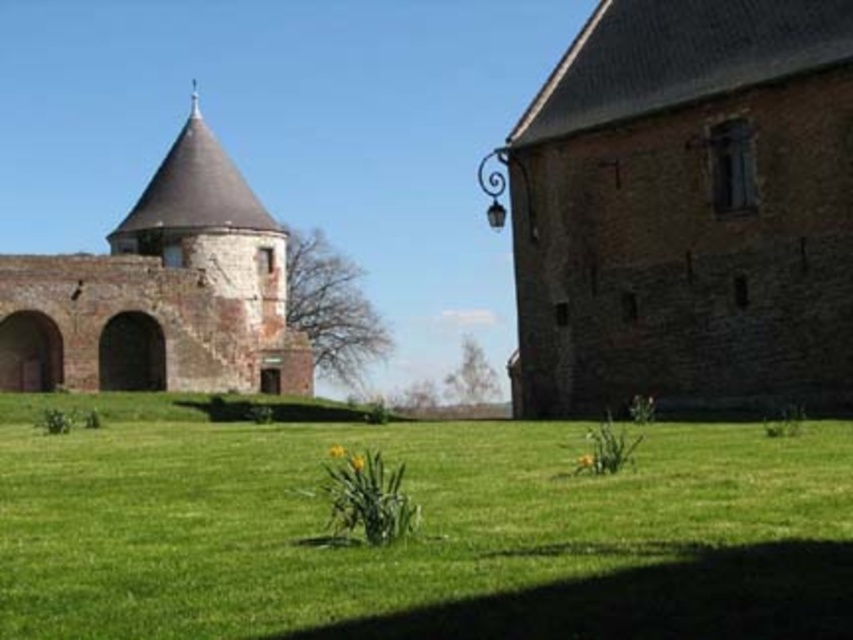
Question: Among these objects, which one is farthest from the camera?

Choices:
 (A) brown brick church at right
 (B) green grass at center
 (C) rustic brick tower at left

Answer: (C)

Question: Is green grass at center to the right of brown brick church at right from the viewer's perspective?

Choices:
 (A) no
 (B) yes

Answer: (A)

Question: Based on their relative distances, which object is farther from the green grass at center?

Choices:
 (A) brown brick church at right
 (B) rustic brick tower at left

Answer: (B)

Question: Among these points, which one is nearest to the camera?

Choices:
 (A) (560, 291)
 (B) (714, 545)
 (C) (273, 300)

Answer: (B)

Question: Observing the image, what is the correct spatial positioning of green grass at center in reference to rustic brick tower at left?

Choices:
 (A) above
 (B) below

Answer: (B)

Question: Can you confirm if green grass at center is smaller than rustic brick tower at left?

Choices:
 (A) no
 (B) yes

Answer: (B)